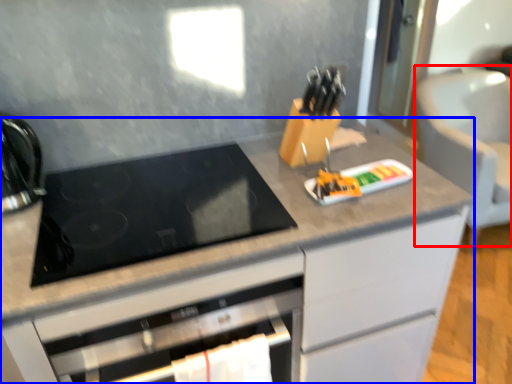
Question: Which object appears closest to the camera in this image, armchair (highlighted by a red box) or cabinetry (highlighted by a blue box)?

Choices:
 (A) armchair
 (B) cabinetry

Answer: (B)